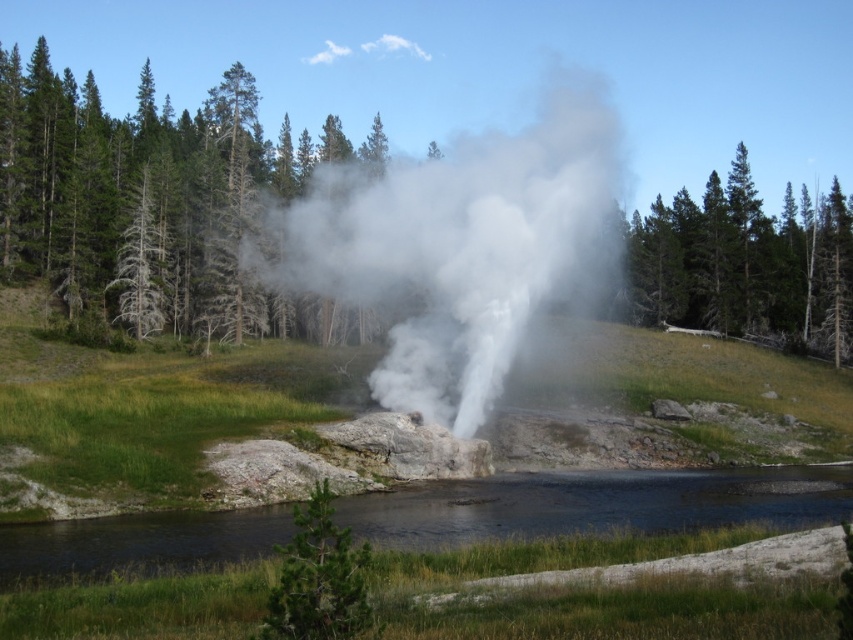
You are standing in front of the geyser and want to walk from point (462, 266) to point (590, 476). Which direction should you move relative to the geyser?

You should move away from the geyser because point (462, 266) is closer to you than point (590, 476).

You are standing at the edge of the geothermal area and notice the white vapor steam at center and the clear water at center. Which object is closer to you?

The white vapor steam at center is closer to you than the clear water at center because it is further to the viewer.